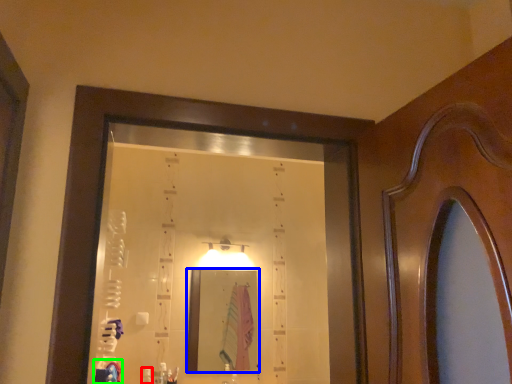
Question: Based on their relative distances, which object is farther from toiletry (highlighted by a red box)? Choose from mirror (highlighted by a blue box) and robe (highlighted by a green box).

Choices:
 (A) mirror
 (B) robe

Answer: (A)